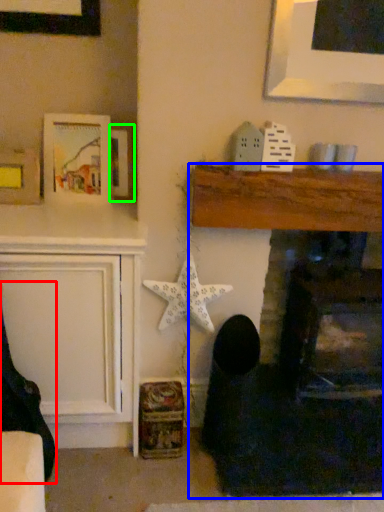
Question: Which object is positioned closest to rocking chair (highlighted by a red box)? Select from fireplace (highlighted by a blue box) and picture frame (highlighted by a green box).

Choices:
 (A) fireplace
 (B) picture frame

Answer: (B)